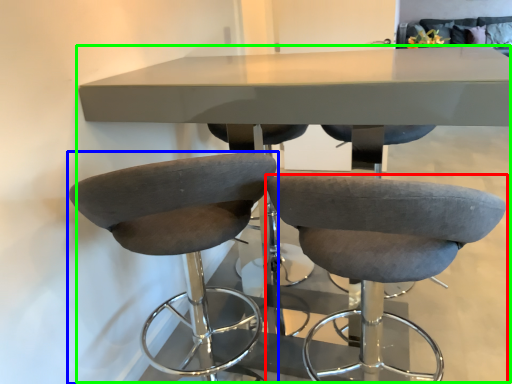
Question: Which is nearer to the chair (highlighted by a red box)? chair (highlighted by a blue box) or table (highlighted by a green box).

Choices:
 (A) chair
 (B) table

Answer: (A)